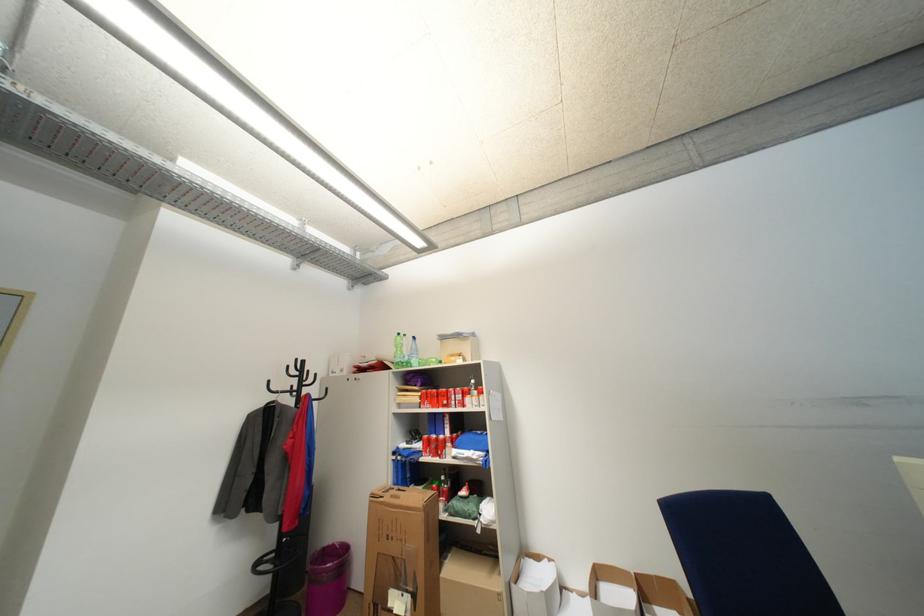
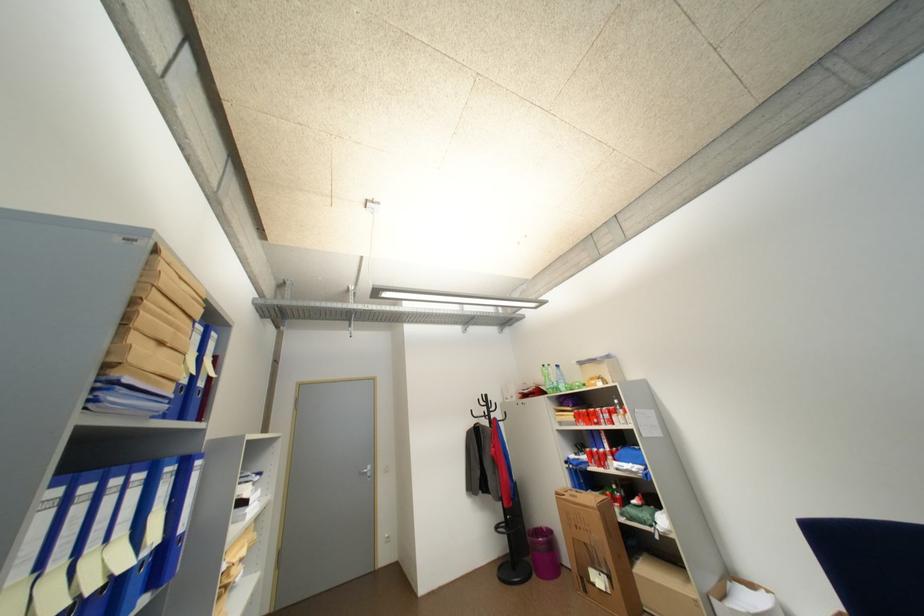
Question: How did the camera likely rotate?

Choices:
 (A) Left
 (B) Right
 (C) Up
 (D) Down

Answer: (A)